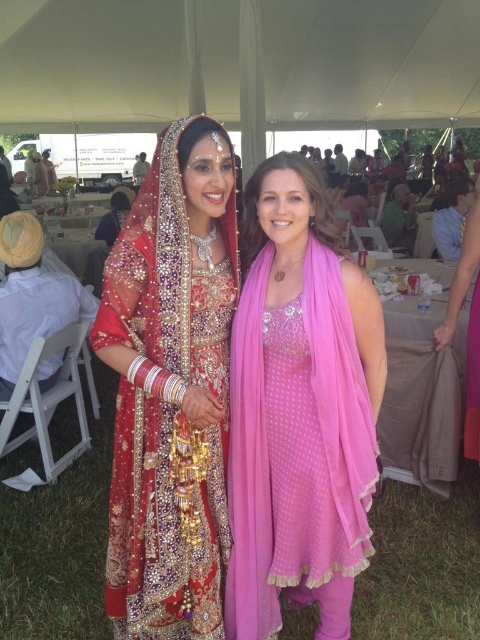
You are a photographer at the event and want to capture a closeup of the pink sheer scarf at center and the matte gold jewelry at center. Which one is positioned lower in the image?

The pink sheer scarf at center is positioned below the matte gold jewelry at center, so it is lower in the image.

You are a photographer at the event and need to capture a closeup shot of both the pink sheer scarf at center and the matte gold jewelry at center. Which object should you focus on first if you want to ensure both are in the frame without adjusting the camera position?

The pink sheer scarf at center is shorter than matte gold jewelry at center, so you should focus on the matte gold jewelry at center first to ensure both objects are within the frame.